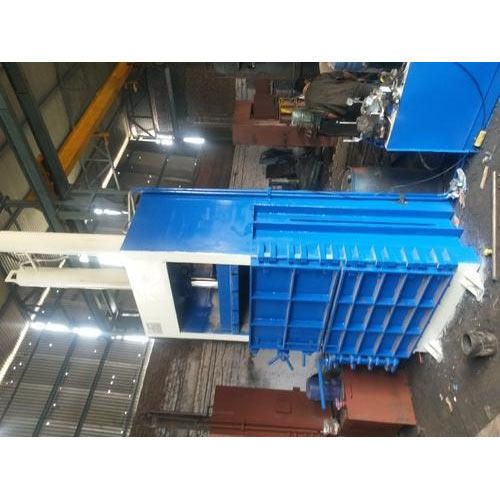
The height and width of the screenshot is (500, 500). I want to click on blue big shelf, so click(x=284, y=298), click(x=207, y=229).